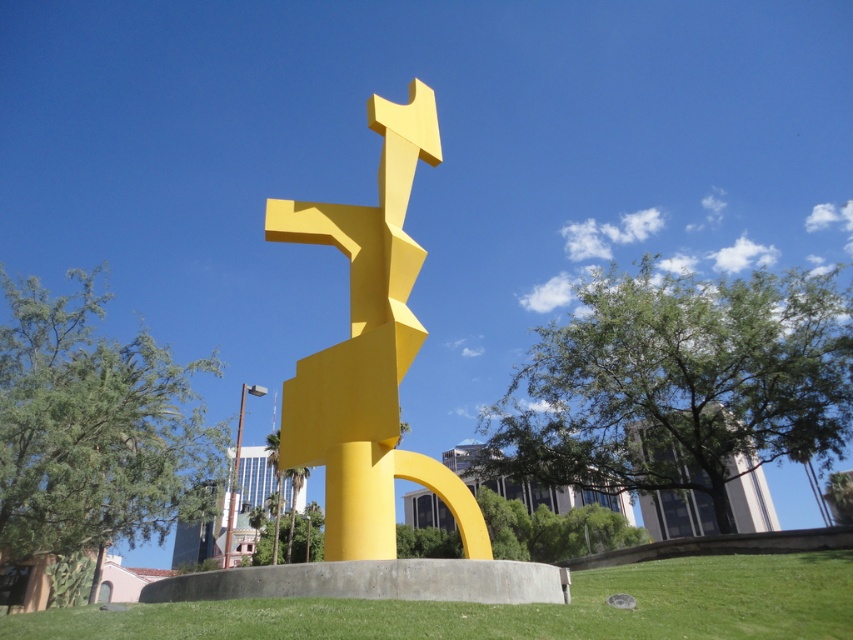
You are planning to place a new bench in the park. The bench requires a space wider than the matte yellow sculpture at center. Based on the scene, is the green grass at center area wide enough for the bench?

The matte yellow sculpture at center has a width less than the green grass at center, so the green grass at center area is wide enough for the bench since it is wider than the sculpture.

You are a photographer planning to take a closeup shot of the matte yellow sculpture at center. Since the green grass at center is in the foreground, will you need to adjust your camera focus to ensure the sculpture is in focus?

The matte yellow sculpture at center is larger than the green grass at center, so it will likely occupy more of the frame. However, since the grass is closer to the camera, you may need to adjust focus to ensure the sculpture remains sharp.

You are a photographer planning to capture the matte yellow sculpture at center and the green grass at center in a single shot. Based on their positions, which object is located to the right side of the other?

The matte yellow sculpture at center is positioned on the left side of green grass at center, so the green grass at center is to the right of the matte yellow sculpture at center.